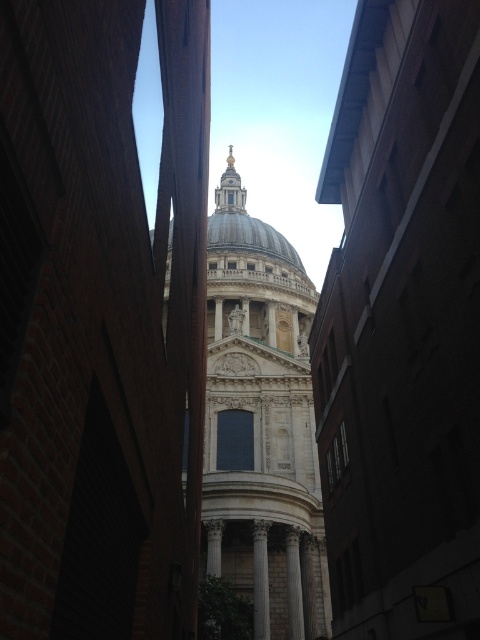
This screenshot has height=640, width=480. What are the coordinates of `white marble dome at center` in the screenshot? It's located at (244, 225).

How distant is white marble dome at center from white marble column at center?

A distance of 87.75 meters exists between white marble dome at center and white marble column at center.

You are a GUI agent. You are given a task and a screenshot of the screen. Output one action in this format:
    pyautogui.click(x=<x>, y=<y>)
    Task: Click on the white marble dome at center
    Image resolution: width=480 pixels, height=640 pixels.
    Given the screenshot: What is the action you would take?
    pyautogui.click(x=244, y=225)

The height and width of the screenshot is (640, 480). What do you see at coordinates (260, 410) in the screenshot? I see `white stone church at center` at bounding box center [260, 410].

Is white stone church at center positioned in front of white marble column at center?

Yes.

The height and width of the screenshot is (640, 480). Describe the element at coordinates (260, 410) in the screenshot. I see `white stone church at center` at that location.

Image resolution: width=480 pixels, height=640 pixels. In order to click on white stone church at center in this screenshot , I will do `click(260, 410)`.

Between white stone church at center and white marble dome at center, which one appears on the right side from the viewer's perspective?

white marble dome at center

Does white stone church at center have a lesser height compared to white marble dome at center?

In fact, white stone church at center may be taller than white marble dome at center.

Where is `white stone church at center`? white stone church at center is located at coordinates (260, 410).